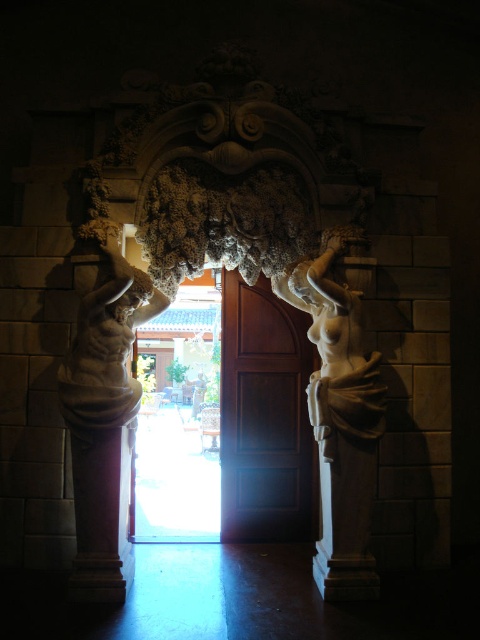
Does white marble statue at left have a smaller size compared to marble statue at left?

No.

Can you confirm if white marble statue at left is wider than marble statue at left?

Correct, the width of white marble statue at left exceeds that of marble statue at left.

Who is more distant from viewer, (130,461) or (88,444)?

Positioned behind is point (130,461).

The image size is (480, 640). In order to click on white marble statue at left in this screenshot , I will do `click(104, 424)`.

Which of these two, white marble statue at right or marble statue at left, stands shorter?

marble statue at left is shorter.

Describe the element at coordinates (339, 419) in the screenshot. The height and width of the screenshot is (640, 480). I see `white marble statue at right` at that location.

This screenshot has width=480, height=640. What are the coordinates of `white marble statue at right` in the screenshot? It's located at (339, 419).

Where is `white marble statue at right`? Image resolution: width=480 pixels, height=640 pixels. white marble statue at right is located at coordinates (339, 419).

Does white marble statue at right come in front of white marble statue at left?

No, white marble statue at right is further to the viewer.

Between white marble statue at right and white marble statue at left, which one appears on the left side from the viewer's perspective?

From the viewer's perspective, white marble statue at left appears more on the left side.

Is point (320, 312) positioned after point (58, 378)?

Yes, point (320, 312) is farther from viewer.

At what (x,y) coordinates should I click in order to perform the action: click on white marble statue at right. Please return your answer as a coordinate pair (x, y). Image resolution: width=480 pixels, height=640 pixels. Looking at the image, I should click on (339, 419).